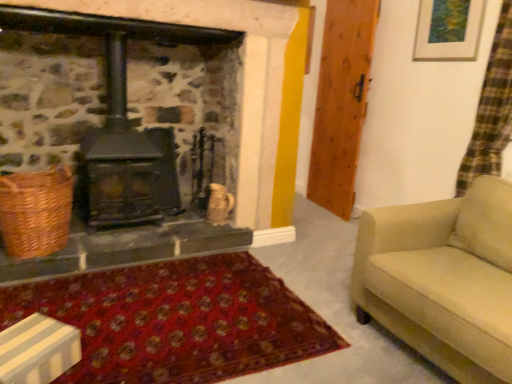
Question: Based on their sizes in the image, would you say beige fabric couch at right is bigger or smaller than black cast iron wood burning stove at center?

Choices:
 (A) big
 (B) small

Answer: (A)

Question: Considering the positions of beige fabric couch at right and black cast iron wood burning stove at center in the image, is beige fabric couch at right taller or shorter than black cast iron wood burning stove at center?

Choices:
 (A) short
 (B) tall

Answer: (A)

Question: Estimate the real-world distances between objects in this image. Which object is closer to the woven brown basket at left?

Choices:
 (A) wooden door at right
 (B) wooden picture frame at upper right
 (C) black cast iron wood burning stove at center
 (D) beige fabric couch at right

Answer: (C)

Question: Which of these objects is positioned farthest from the wooden picture frame at upper right?

Choices:
 (A) wooden door at right
 (B) black cast iron wood burning stove at center
 (C) woven brown basket at left
 (D) beige fabric couch at right

Answer: (C)